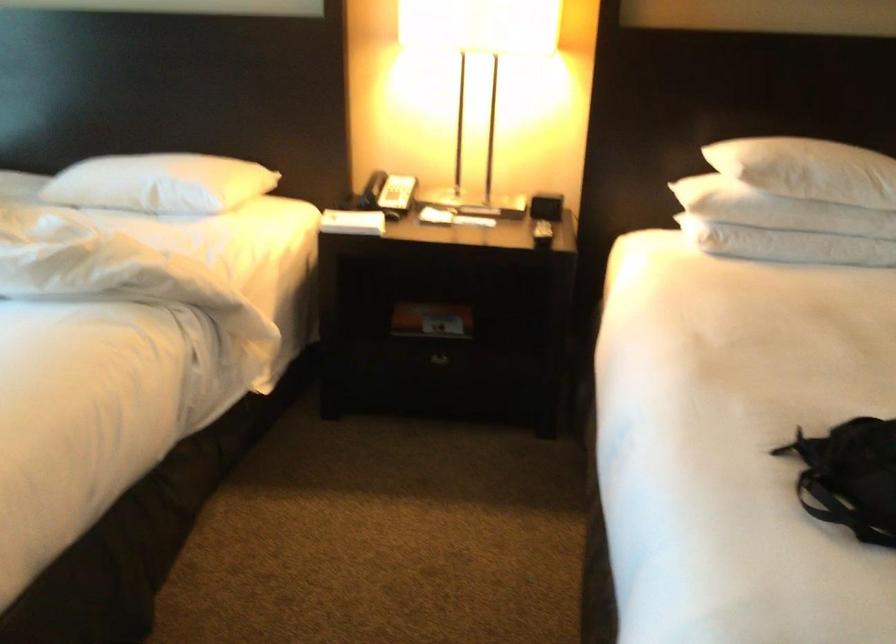
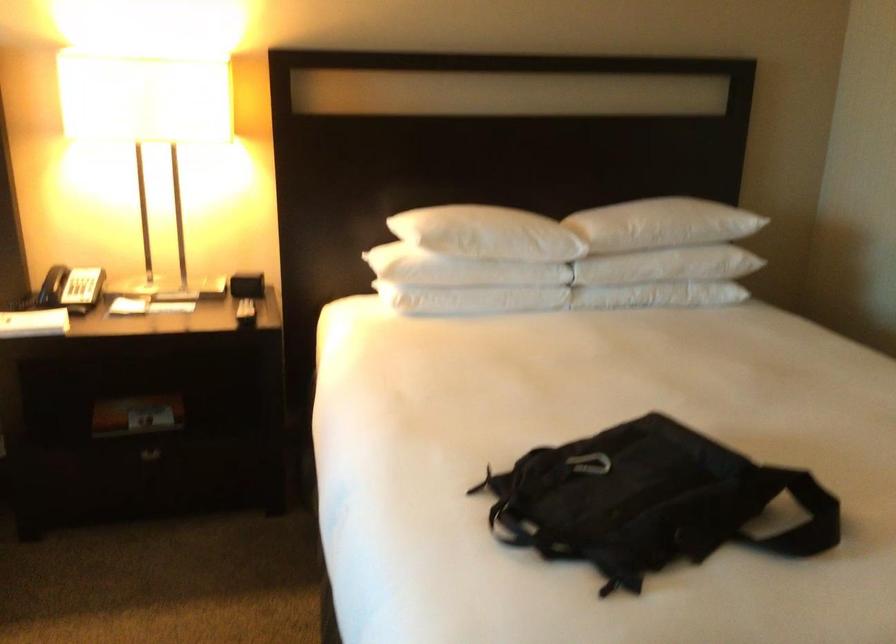
Question: The camera is either moving clockwise (left) or counter-clockwise (right) around the object. The first image is from the beginning of the video and the second image is from the end. Is the camera moving left or right when shooting the video?

Choices:
 (A) Left
 (B) Right

Answer: (A)